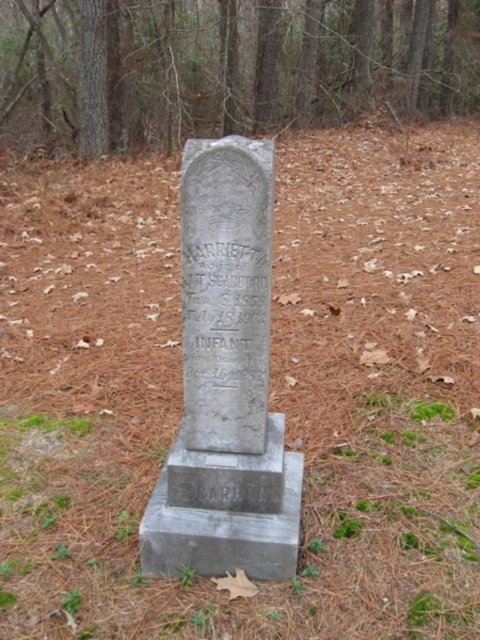
Does smooth gray stone at center have a lesser height compared to gray stone gravestone at center?

Incorrect, smooth gray stone at center's height does not fall short of gray stone gravestone at center's.

Where is `smooth gray stone at center`? The width and height of the screenshot is (480, 640). smooth gray stone at center is located at coordinates (226, 67).

Is point (452, 58) in front of point (216, 410)?

No, it is not.

Where is `smooth gray stone at center`? The image size is (480, 640). smooth gray stone at center is located at coordinates (226, 67).